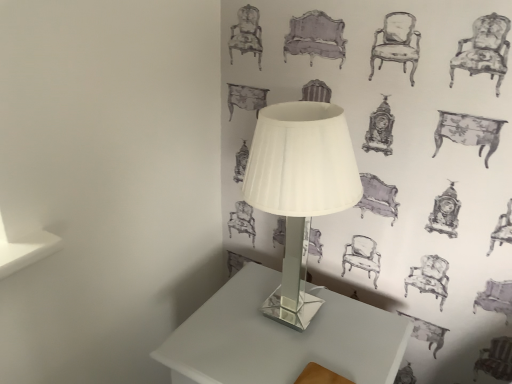
Measure the distance between point (265, 166) and camera.

30.51 inches.

You are a GUI agent. You are given a task and a screenshot of the screen. Output one action in this format:
    pyautogui.click(x=<x>, y=<y>)
    Task: Click on the white glass lamp at center
    Image resolution: width=512 pixels, height=384 pixels.
    Given the screenshot: What is the action you would take?
    pyautogui.click(x=300, y=189)

Image resolution: width=512 pixels, height=384 pixels. What do you see at coordinates (300, 189) in the screenshot? I see `white glass lamp at center` at bounding box center [300, 189].

Describe the element at coordinates (282, 338) in the screenshot. I see `white glossy table at center` at that location.

Measure the distance between point [239,301] and camera.

The distance of point [239,301] from camera is 1.03 meters.

Image resolution: width=512 pixels, height=384 pixels. I want to click on white glossy table at center, so click(282, 338).

I want to click on white glass lamp at center, so click(x=300, y=189).

Considering the relative positions of white glass lamp at center and white glossy table at center in the image provided, is white glass lamp at center to the left of white glossy table at center from the viewer's perspective?

In fact, white glass lamp at center is to the right of white glossy table at center.

Is white glass lamp at center in front of or behind white glossy table at center in the image?

Clearly, white glass lamp at center is in front of white glossy table at center.

Does point (297, 115) come behind point (253, 368)?

No, (297, 115) is closer to viewer.

From the image's perspective, which one is positioned lower, white glass lamp at center or white glossy table at center?

white glossy table at center.

From a real-world perspective, is white glass lamp at center under white glossy table at center?

Actually, white glass lamp at center is physically above white glossy table at center in the real world.

Considering the sizes of objects white glass lamp at center and white glossy table at center in the image provided, who is wider, white glass lamp at center or white glossy table at center?

With larger width is white glossy table at center.

Can you confirm if white glass lamp at center is taller than white glossy table at center?

Indeed, white glass lamp at center has a greater height compared to white glossy table at center.

Is white glass lamp at center smaller than white glossy table at center?

Yes, white glass lamp at center is smaller than white glossy table at center.

Can we say white glass lamp at center lies outside white glossy table at center?

Yes, white glass lamp at center is outside of white glossy table at center.

From the picture: Is white glass lamp at center not near white glossy table at center?

No, white glass lamp at center is not far away from white glossy table at center.

Is white glass lamp at center oriented away from white glossy table at center?

No, white glass lamp at center's orientation is not away from white glossy table at center.

Locate an element on the screen. The height and width of the screenshot is (384, 512). table on the left of the white glass lamp at center is located at coordinates (282, 338).

Visually, is white glossy table at center positioned to the left or to the right of white glass lamp at center?

white glossy table at center is to the left of white glass lamp at center.

Which object is closer to the camera taking this photo, white glossy table at center or white glass lamp at center?

white glass lamp at center.

Between point (210, 341) and point (274, 181), which one is positioned behind?

Positioned behind is point (210, 341).

From the image's perspective, between white glossy table at center and white glass lamp at center, which one is located above?

white glass lamp at center, from the image's perspective.

From a real-world perspective, is white glossy table at center below white glass lamp at center?

Yes, from a real-world perspective, white glossy table at center is below white glass lamp at center.

Which of these two, white glossy table at center or white glass lamp at center, is wider?

white glossy table at center is wider.

Which of these two, white glossy table at center or white glass lamp at center, stands taller?

With more height is white glass lamp at center.

Considering the sizes of objects white glossy table at center and white glass lamp at center in the image provided, who is smaller, white glossy table at center or white glass lamp at center?

Smaller between the two is white glass lamp at center.

Would you say white glossy table at center contains white glass lamp at center?

No, white glass lamp at center is not a part of white glossy table at center.

Is white glossy table at center positioned far away from white glass lamp at center?

That's not correct — white glossy table at center is a little close to white glass lamp at center.

Is white glass lamp at center at the back of white glossy table at center?

white glossy table at center is not turned away from white glass lamp at center.

What's the angular difference between white glossy table at center and white glass lamp at center's facing directions?

The angular difference between white glossy table at center and white glass lamp at center is 1.54 degrees.

Find the location of `lamp on the right of white glossy table at center`. lamp on the right of white glossy table at center is located at coordinates (300, 189).

The width and height of the screenshot is (512, 384). What are the coordinates of `lamp above the white glossy table at center (from the image's perspective)` in the screenshot? It's located at (300, 189).

Locate an element on the screen. This screenshot has height=384, width=512. table that is under the white glass lamp at center (from a real-world perspective) is located at coordinates (282, 338).